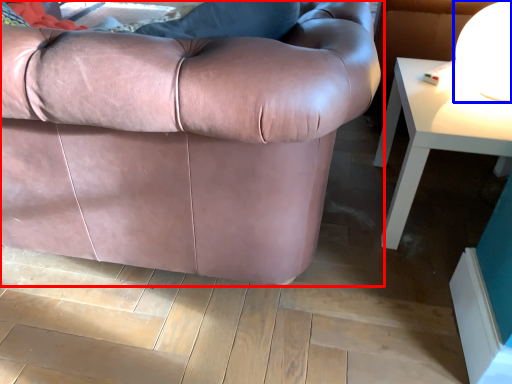
Question: Which of the following is the closest to the observer, studio couch (highlighted by a red box) or table lamp (highlighted by a blue box)?

Choices:
 (A) studio couch
 (B) table lamp

Answer: (A)